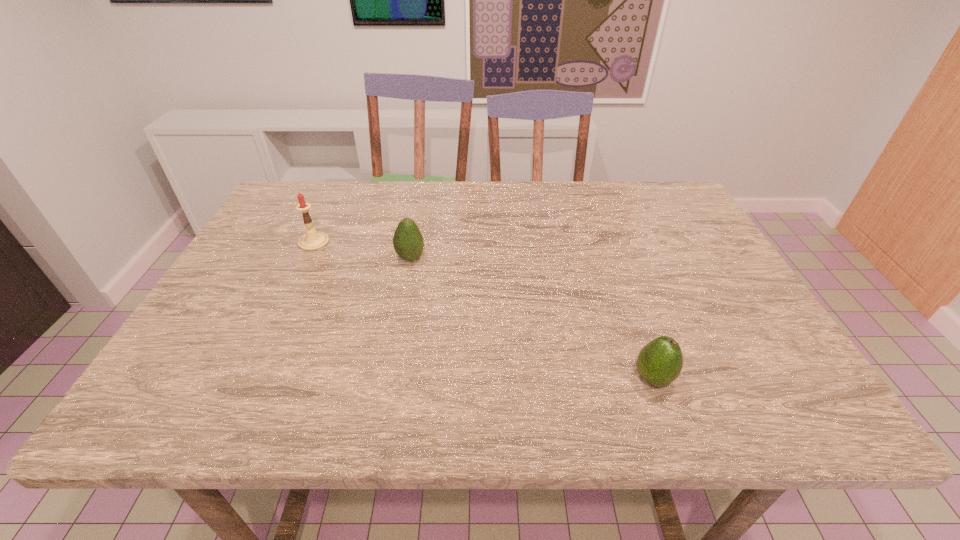
You are a GUI agent. You are given a task and a screenshot of the screen. Output one action in this format:
    pyautogui.click(x=<x>, y=<y>)
    Task: Click on the candle
    
    Given the screenshot: What is the action you would take?
    pyautogui.click(x=312, y=240)

Locate an element on the screen. the tallest object is located at coordinates (312, 240).

Identify the location of the left avocado. This screenshot has height=540, width=960. (408, 243).

You are a GUI agent. You are given a task and a screenshot of the screen. Output one action in this format:
    pyautogui.click(x=<x>, y=<y>)
    Task: Click on the farther avocado
    The height and width of the screenshot is (540, 960).
    Given the screenshot: What is the action you would take?
    pyautogui.click(x=408, y=243)

I want to click on the nearest object, so click(x=659, y=363).

Locate an element on the screen. Image resolution: width=960 pixels, height=540 pixels. the nearer avocado is located at coordinates (659, 363).

At what (x,y) coordinates should I click in order to perform the action: click on blank space located 0.170m on the front of the tallest object. Please return your answer as a coordinate pair (x, y). This screenshot has height=540, width=960. Looking at the image, I should click on (288, 296).

The image size is (960, 540). In order to click on free region located 0.170m on the back of the left avocado in this screenshot , I will do `click(419, 213)`.

At what (x,y) coordinates should I click in order to perform the action: click on free space located on the back of the rightmost object. Please return your answer as a coordinate pair (x, y). The height and width of the screenshot is (540, 960). Looking at the image, I should click on (618, 281).

Where is `object present at the near edge`? Image resolution: width=960 pixels, height=540 pixels. object present at the near edge is located at coordinates (659, 363).